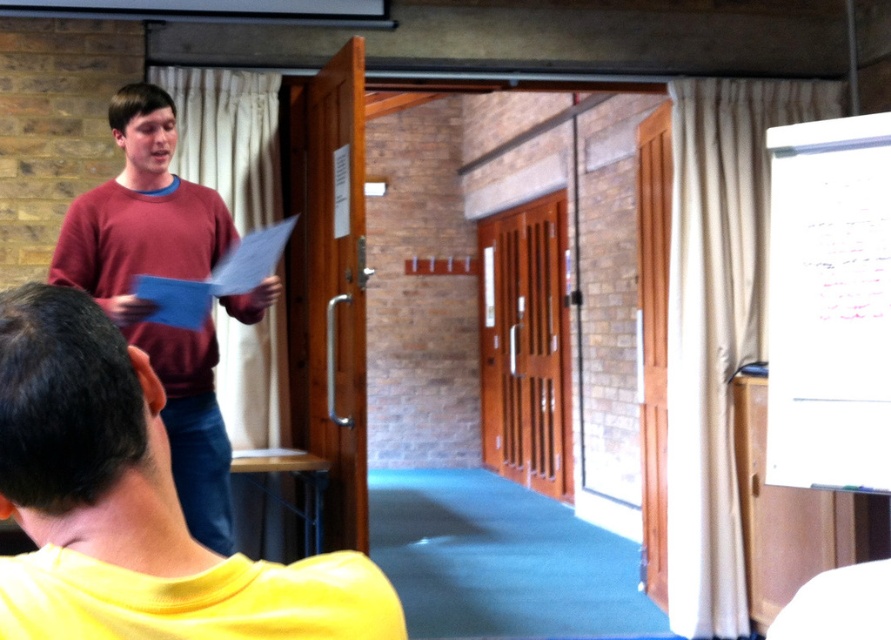
Is yellow matte shirt at lower left positioned in front of maroon sweater at left?

Yes, it is.

Between point (96, 307) and point (131, 163), which one is positioned behind?

Point (131, 163)

Image resolution: width=891 pixels, height=640 pixels. Find the location of `yellow matte shirt at lower left`. yellow matte shirt at lower left is located at coordinates (132, 506).